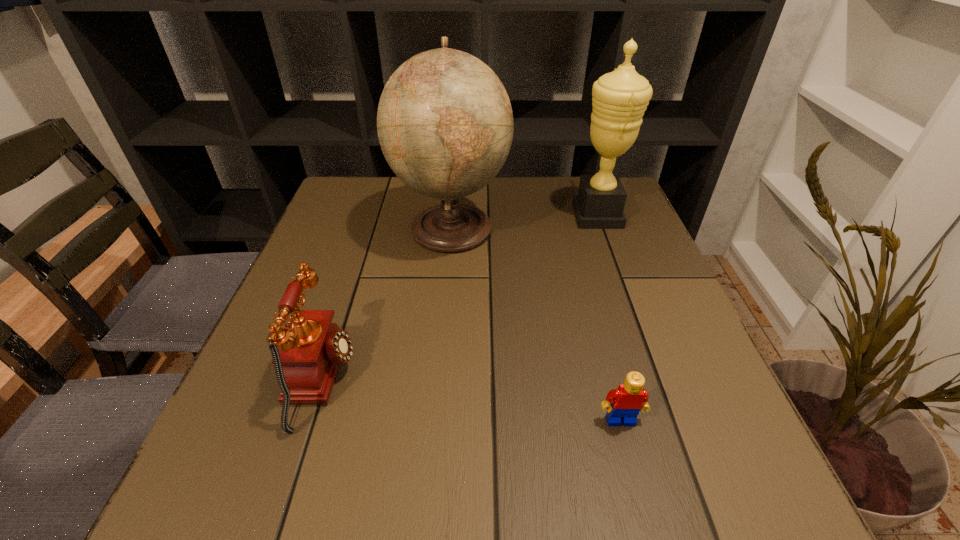
This screenshot has width=960, height=540. In order to click on globe in this screenshot , I will do `click(445, 125)`.

Find the location of a particular element. trophy cup is located at coordinates (619, 99).

Where is `telephone`? telephone is located at coordinates pyautogui.click(x=310, y=349).

I want to click on the third tallest object, so click(x=310, y=349).

Image resolution: width=960 pixels, height=540 pixels. What are the coordinates of `Lego` in the screenshot? It's located at (628, 399).

This screenshot has height=540, width=960. Identify the location of vacant space situated 0.270m on the front-facing side of the globe. (615, 227).

Identify the location of vacant region located at the front of the trophy cup with handles. (496, 215).

Where is `free point located 0.360m at the front of the trophy cup with handles`? free point located 0.360m at the front of the trophy cup with handles is located at coordinates (435, 215).

Image resolution: width=960 pixels, height=540 pixels. What are the coordinates of `free spot located 0.150m at the front of the trophy cup with handles` in the screenshot? It's located at (516, 215).

Find the location of `vacant space located on the dial of the second shortest object`. vacant space located on the dial of the second shortest object is located at coordinates (527, 380).